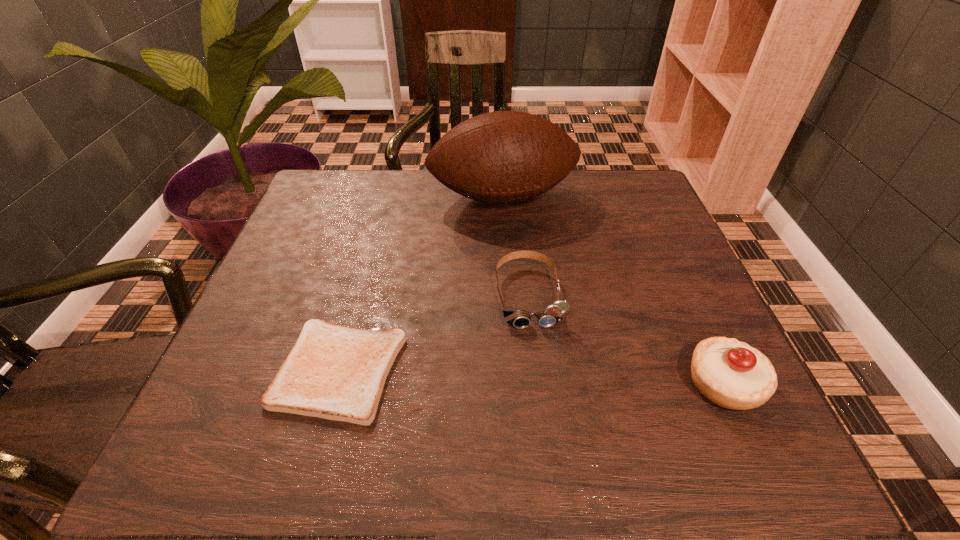
Where is `free spot on the desktop that is between the leftmost object and the rightmost object and is positioned on the laces of the football`? This screenshot has height=540, width=960. free spot on the desktop that is between the leftmost object and the rightmost object and is positioned on the laces of the football is located at coordinates point(568,378).

The width and height of the screenshot is (960, 540). I want to click on vacant spot on the desktop that is between the leftmost object and the pastry and is positioned on the front-facing side of the second shortest object, so click(x=544, y=377).